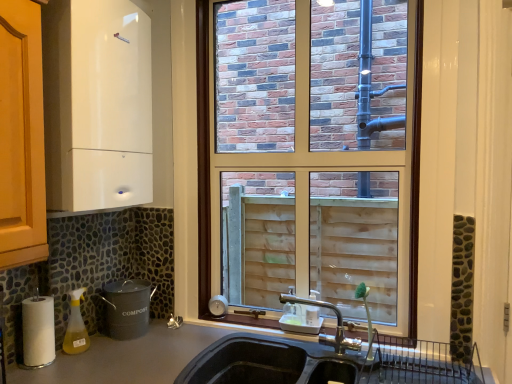
Find the location of a particular element. The height and width of the screenshot is (384, 512). free spot below gold metallic faucet at center (from a real-world perspective) is located at coordinates (328, 348).